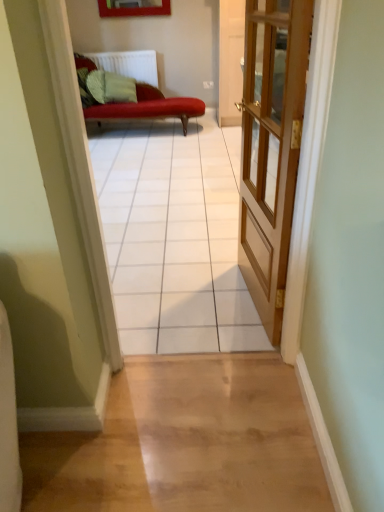
Question: Could you tell me if white tile floor at center is facing white plastic radiator at upper center?

Choices:
 (A) yes
 (B) no

Answer: (A)

Question: From a real-world perspective, is white tile floor at center on white plastic radiator at upper center?

Choices:
 (A) yes
 (B) no

Answer: (A)

Question: From the image's perspective, is white tile floor at center located above white plastic radiator at upper center?

Choices:
 (A) no
 (B) yes

Answer: (A)

Question: Considering the relative positions of white tile floor at center and white plastic radiator at upper center in the image provided, is white tile floor at center to the right of white plastic radiator at upper center from the viewer's perspective?

Choices:
 (A) yes
 (B) no

Answer: (A)

Question: Is white tile floor at center surrounding white plastic radiator at upper center?

Choices:
 (A) no
 (B) yes

Answer: (A)

Question: Looking at their shapes, would you say white plastic radiator at upper center is wider or thinner than wooden door at center?

Choices:
 (A) thin
 (B) wide

Answer: (B)

Question: Considering the positions of white plastic radiator at upper center and wooden door at center in the image, is white plastic radiator at upper center taller or shorter than wooden door at center?

Choices:
 (A) short
 (B) tall

Answer: (A)

Question: From the image's perspective, relative to wooden door at center, is white plastic radiator at upper center above or below?

Choices:
 (A) below
 (B) above

Answer: (B)

Question: Considering the relative positions of white plastic radiator at upper center and wooden door at center in the image provided, is white plastic radiator at upper center to the left or to the right of wooden door at center?

Choices:
 (A) right
 (B) left

Answer: (B)

Question: Relative to white plastic radiator at upper center, is wooden door at center in front or behind?

Choices:
 (A) behind
 (B) front

Answer: (B)

Question: Is point (246, 55) positioned closer to the camera than point (104, 62)?

Choices:
 (A) closer
 (B) farther

Answer: (A)

Question: Based on their sizes in the image, would you say wooden door at center is bigger or smaller than white plastic radiator at upper center?

Choices:
 (A) small
 (B) big

Answer: (B)

Question: Considering the positions of wooden door at center and white plastic radiator at upper center in the image, is wooden door at center wider or thinner than white plastic radiator at upper center?

Choices:
 (A) thin
 (B) wide

Answer: (A)

Question: Is wooden door at center inside or outside of white tile floor at center?

Choices:
 (A) outside
 (B) inside

Answer: (A)

Question: From the image's perspective, is wooden door at center located above or below white tile floor at center?

Choices:
 (A) below
 (B) above

Answer: (B)